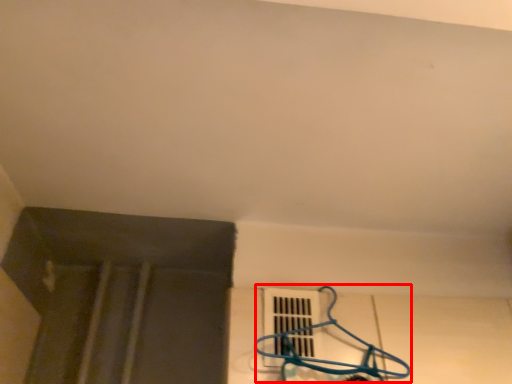
Question: From the image, what is the correct spatial relationship of hanger (annotated by the red box) in relation to window?

Choices:
 (A) left
 (B) right

Answer: (B)